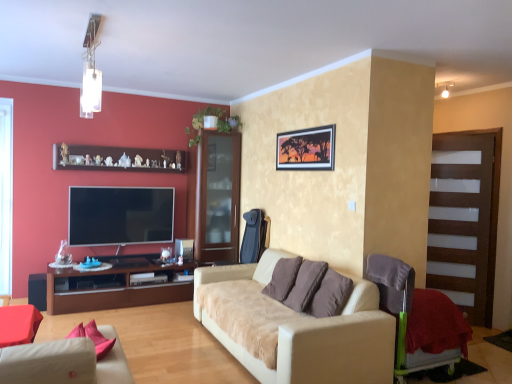
Question: Is brown glass cabinet at center in front of or behind matte beige studio couch at lower left, which ranks as the 1th studio couch in left-to-right order, in the image?

Choices:
 (A) behind
 (B) front

Answer: (A)

Question: Considering the positions of point (207, 208) and point (31, 357), is point (207, 208) closer or farther from the camera than point (31, 357)?

Choices:
 (A) closer
 (B) farther

Answer: (B)

Question: Estimate the real-world distances between objects in this image. Which object is farther from the transparent glass window screen at left?

Choices:
 (A) matte beige studio couch at lower left, positioned as the second studio couch in back-to-front order
 (B) beige fabric couch at center, positioned as the second studio couch in front-to-back order
 (C) red textured blanket at lower right
 (D) brown glass cabinet at center
 (E) matte red chair at lower left, the 2th chair viewed from the back

Answer: (C)

Question: Estimate the real-world distances between objects in this image. Which object is farther from the wooden shelf at upper center?

Choices:
 (A) beige fabric couch at center, the 1th studio couch when ordered from back to front
 (B) red textured blanket at lower right
 (C) brown fabric pillow at center
 (D) transparent glass cabinet at right
 (E) matte red chair at lower left, the 2th chair viewed from the back

Answer: (B)